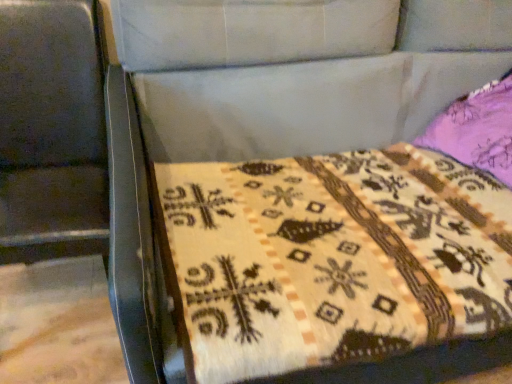
Question: From a real-world perspective, is metallic swivel chair at left positioned under beige woven quilt at center based on gravity?

Choices:
 (A) no
 (B) yes

Answer: (A)

Question: Is metallic swivel chair at left positioned far away from beige woven quilt at center?

Choices:
 (A) yes
 (B) no

Answer: (B)

Question: Is metallic swivel chair at left aimed at beige woven quilt at center?

Choices:
 (A) yes
 (B) no

Answer: (B)

Question: Is metallic swivel chair at left to the right of beige woven quilt at center from the viewer's perspective?

Choices:
 (A) no
 (B) yes

Answer: (A)

Question: Considering the relative sizes of metallic swivel chair at left and beige woven quilt at center in the image provided, is metallic swivel chair at left shorter than beige woven quilt at center?

Choices:
 (A) yes
 (B) no

Answer: (B)

Question: From the image's perspective, is metallic swivel chair at left located beneath beige woven quilt at center?

Choices:
 (A) no
 (B) yes

Answer: (A)

Question: Would you say beige woven quilt at center is a long distance from metallic swivel chair at left?

Choices:
 (A) no
 (B) yes

Answer: (A)

Question: From a real-world perspective, is beige woven quilt at center below metallic swivel chair at left?

Choices:
 (A) yes
 (B) no

Answer: (A)

Question: Can you confirm if beige woven quilt at center is thinner than metallic swivel chair at left?

Choices:
 (A) yes
 (B) no

Answer: (B)

Question: Does beige woven quilt at center lie in front of metallic swivel chair at left?

Choices:
 (A) yes
 (B) no

Answer: (B)

Question: Is metallic swivel chair at left surrounded by beige woven quilt at center?

Choices:
 (A) yes
 (B) no

Answer: (B)

Question: Could you tell me if beige woven quilt at center is turned towards metallic swivel chair at left?

Choices:
 (A) yes
 (B) no

Answer: (B)

Question: In terms of width, does metallic swivel chair at left look wider or thinner when compared to beige woven quilt at center?

Choices:
 (A) thin
 (B) wide

Answer: (A)